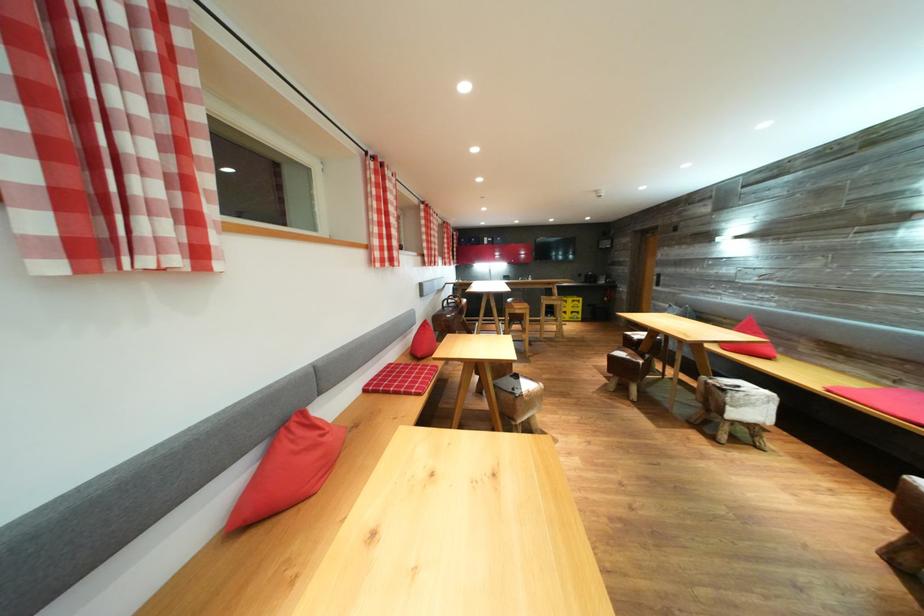
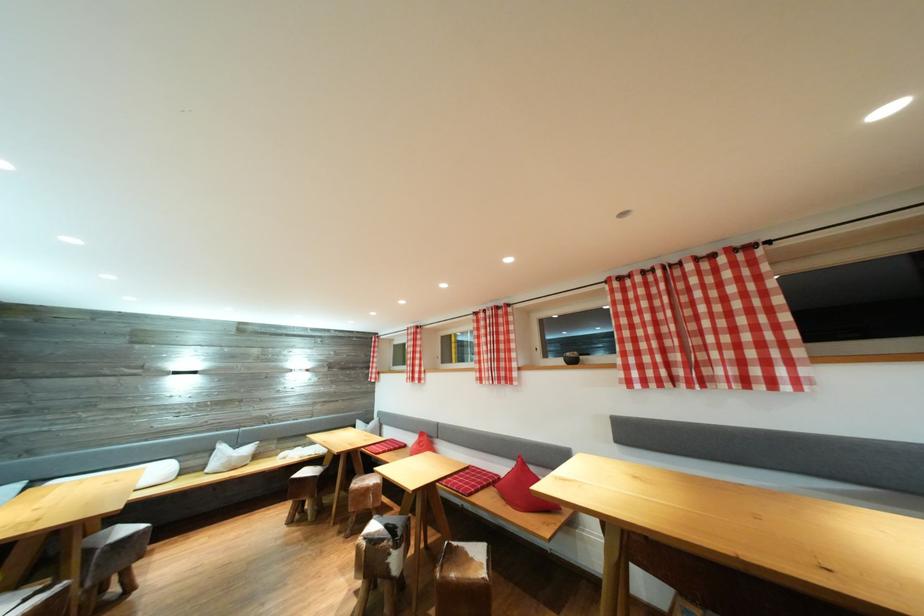
Question: I am providing you with two images of the same scene from different viewpoints. After the viewpoint changes to image2, which objects are now occluded?

Choices:
 (A) bar stool sitting surface
 (B) bathtub knob
 (C) white pillow
 (D) black plant pot

Answer: (A)